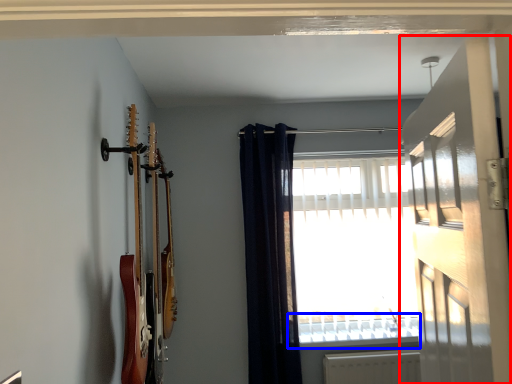
Question: Which object appears farthest to the camera in this image, door (highlighted by a red box) or window sill (highlighted by a blue box)?

Choices:
 (A) door
 (B) window sill

Answer: (B)